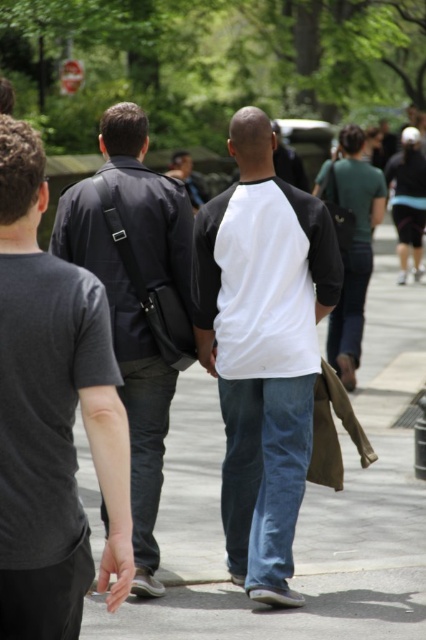
You are a photographer trying to capture a candid shot of the two men in the middle. You notice the white jersey at center and dark gray fabric jacket at center. Which clothing item is shorter in height?

The white jersey at center is shorter in height compared to the dark gray fabric jacket at center.

You are a photographer trying to capture a candid shot of the two men in the middle foreground. You want to ensure that the blue jeans at center and the white jersey at center are both in the frame. Based on their positions, which object should be placed on the right side of the other in your composition?

The blue jeans at center should be placed on the right side of the white jersey at center because the blue jeans at center is positioned on the right side of white jersey at center in the scene.

You are a photographer standing at the back of the three individuals in the scene. You want to take a photo of the white jersey at center and dark gray fabric jacket at center. Can you fit both subjects in the frame if your camera has a 18.5 inch field of view?

The white jersey at center is 20.27 inches from the dark gray fabric jacket at center, which is wider than the camera field of view of 18.5 inches. Therefore, the camera cannot capture both subjects in a single frame without zooming out.